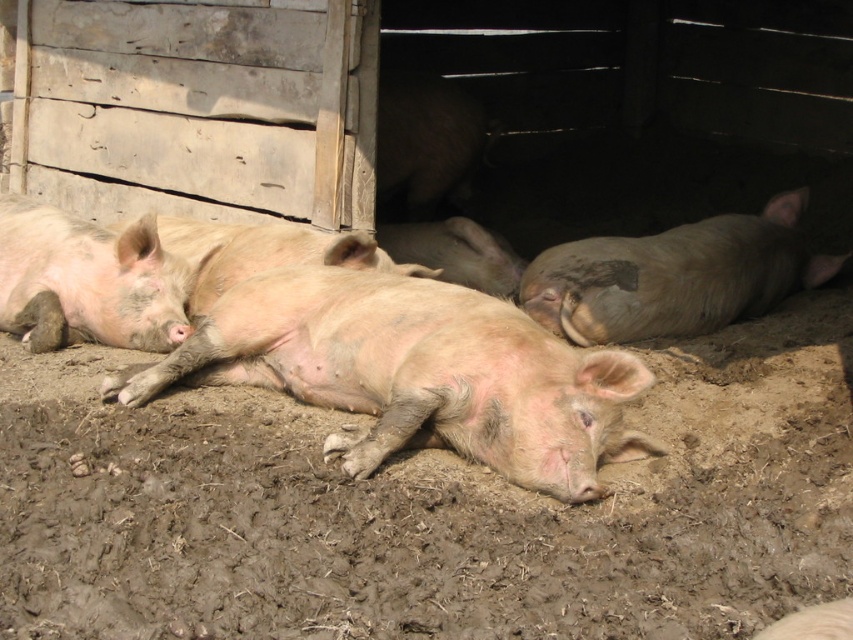
You are a farmer checking the pigs in the barn. You notice the pink muddy pig at center and the gray matte pig at right. Which pig is shorter in height?

The pink muddy pig at center is shorter in height compared to the gray matte pig at right.